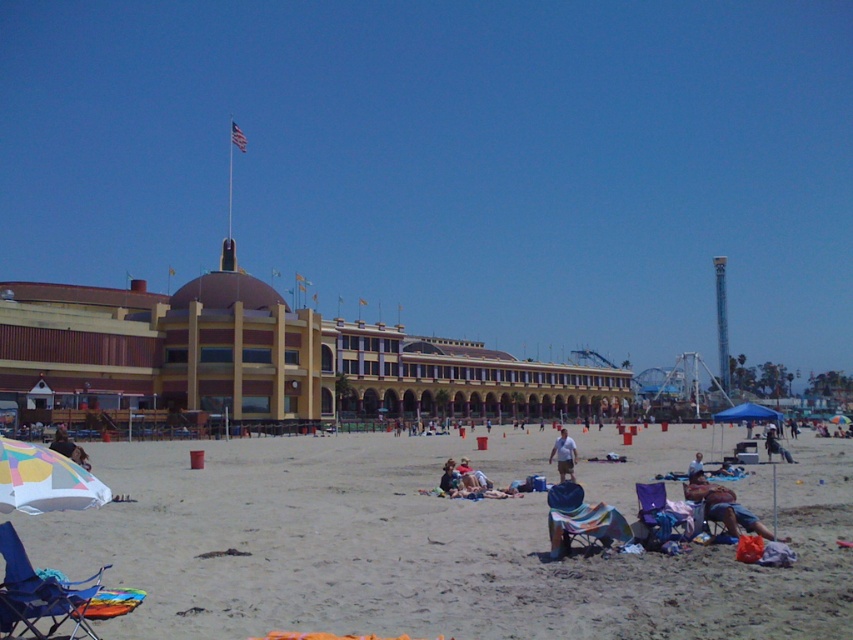
You are standing on the beach and want to walk to both the point at coordinates (548, 531) and the point at coordinates (698, 467). Which point should you reach first if you want to minimize the distance walked?

You should reach point (548, 531) first because it is closer to you than point (698, 467).

You are standing on the beach and want to walk from point A to point B. Point A is at coordinate point (271, 486) and point B is at coordinate point (83, 460). Which point is closer to you when you start walking?

Point A at coordinate point (271, 486) is closer to you than point B at coordinate point (83, 460) because it is further to the viewer.

You are a photographer trying to capture the entire scene of the beige sand beach at center and the beige fabric umbrella at lower left in one shot. Based on their heights, which object should you focus on to ensure both are fully visible in the frame?

The beige sand beach at center has a greater height compared to the beige fabric umbrella at lower left. To ensure both are fully visible, focus on the beige sand beach at center as it is taller, allowing the shorter beige fabric umbrella at lower left to fit into the frame.